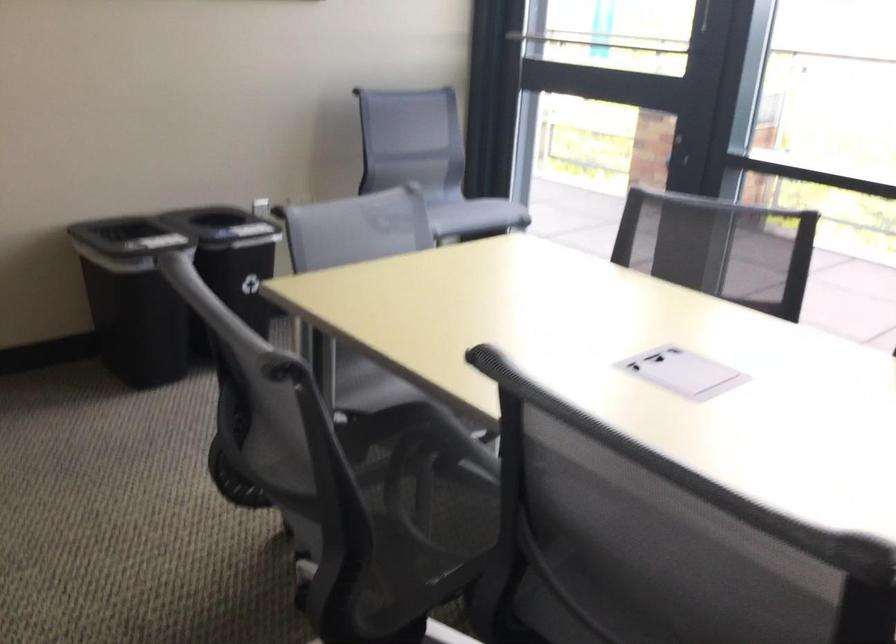
This screenshot has height=644, width=896. Identify the location of gray chair armrest. (350, 399).